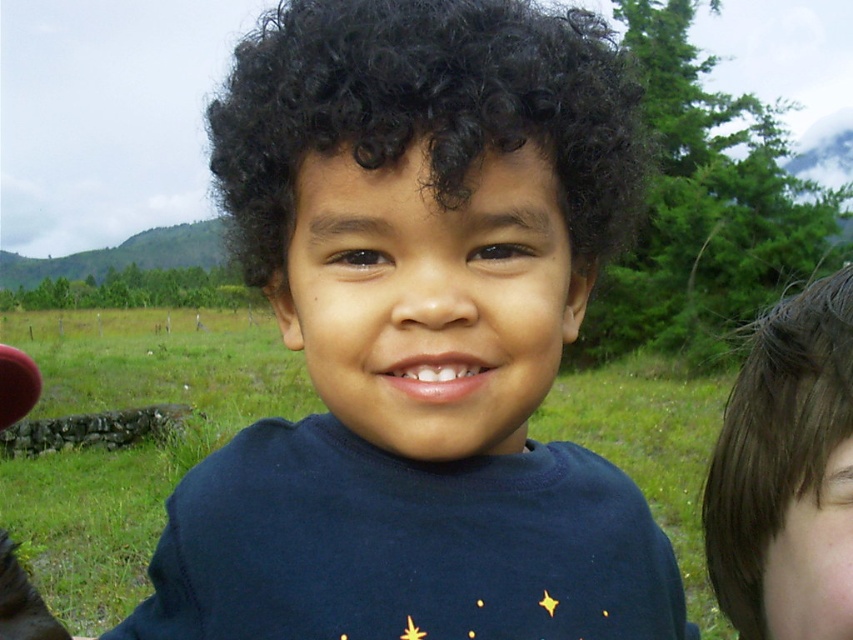
Can you confirm if dark blue t-shirt at center is positioned below brown shiny hair at right?

Incorrect, dark blue t-shirt at center is not positioned below brown shiny hair at right.

At what (x,y) coordinates should I click in order to perform the action: click on dark blue t-shirt at center. Please return your answer as a coordinate pair (x, y). Looking at the image, I should click on (418, 339).

Can you confirm if dark blue t-shirt at center is positioned to the left of black curly hair at center?

No, dark blue t-shirt at center is not to the left of black curly hair at center.

Is dark blue t-shirt at center closer to camera compared to black curly hair at center?

That is True.

Between point (546, 172) and point (622, 118), which one is positioned behind?

Point (622, 118)

At what (x,y) coordinates should I click in order to perform the action: click on dark blue t-shirt at center. Please return your answer as a coordinate pair (x, y). The width and height of the screenshot is (853, 640). Looking at the image, I should click on (418, 339).

Is black curly hair at center taller than brown shiny hair at right?

Yes.

Identify the location of black curly hair at center. (425, 109).

Where is `black curly hair at center`? black curly hair at center is located at coordinates (425, 109).

The height and width of the screenshot is (640, 853). What are the coordinates of `black curly hair at center` in the screenshot? It's located at (425, 109).